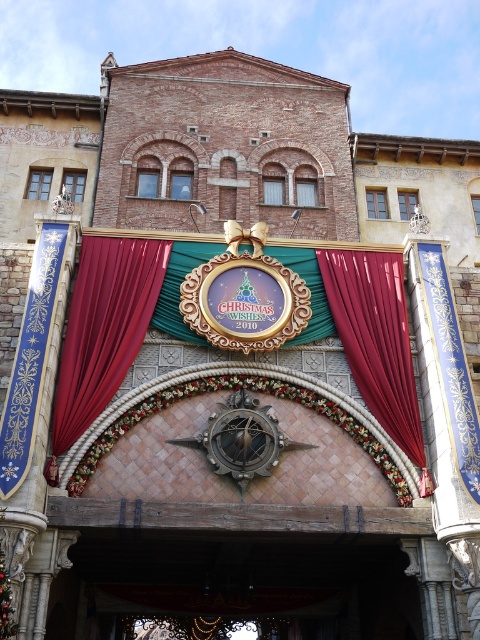
You are a guest arriving at the festive entrance and want to enter through the wooden door at center. However, you notice a red velvet curtain at center blocking your path. Can you walk through the curtain to reach the door?

The wooden door at center is larger in size than the red velvet curtain at center, so the curtain likely does not fully cover the door. You can walk through the curtain to reach the wooden door at center.

You are standing at the entrance of a festive Christmas structure. You see a point marked at coordinates [242,566]. What object is located at this point?

The point at coordinates [242,566] marks the wooden door at center.

Looking at this image, you are standing at the entrance of the festive structure and notice two red velvet curtains. The first is labeled as the velvet red curtain at center, and the second is the red velvet curtain at center. Which one is positioned higher?

The velvet red curtain at center is located above the red velvet curtain at center.